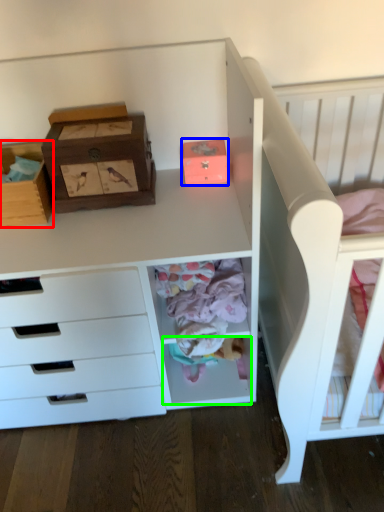
Question: Estimate the real-world distances between objects in this image. Which object is closer to cardboard box (highlighted by a red box), shoe box (highlighted by a blue box) or drawer (highlighted by a green box)?

Choices:
 (A) shoe box
 (B) drawer

Answer: (A)